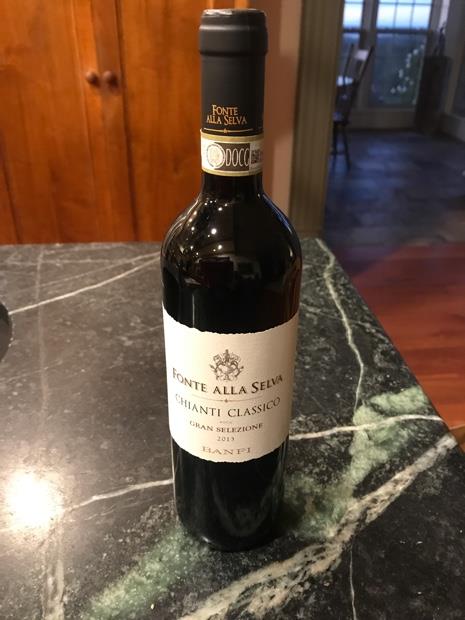
Image resolution: width=465 pixels, height=620 pixels. What are the coordinates of `wooden doors` in the screenshot? It's located at (53, 82), (146, 74).